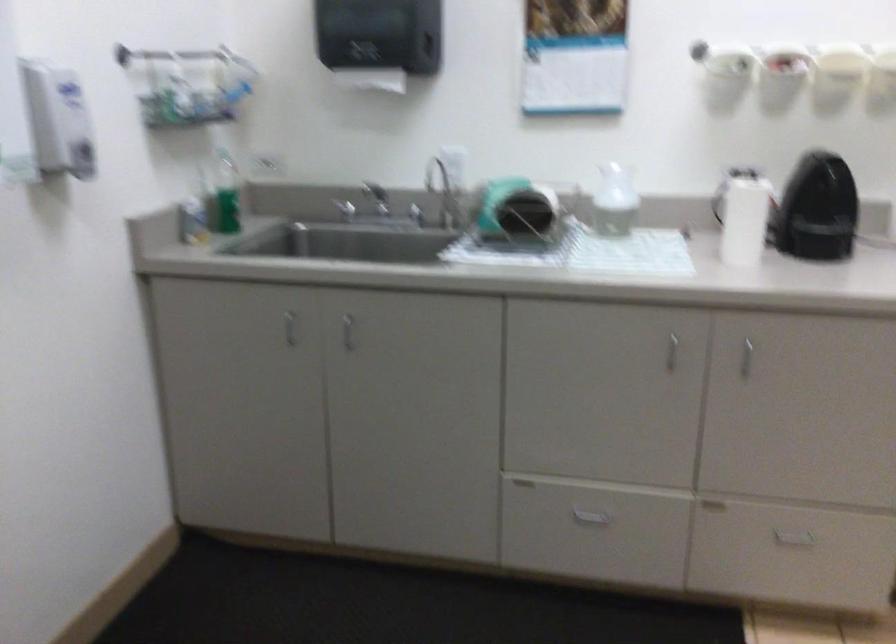
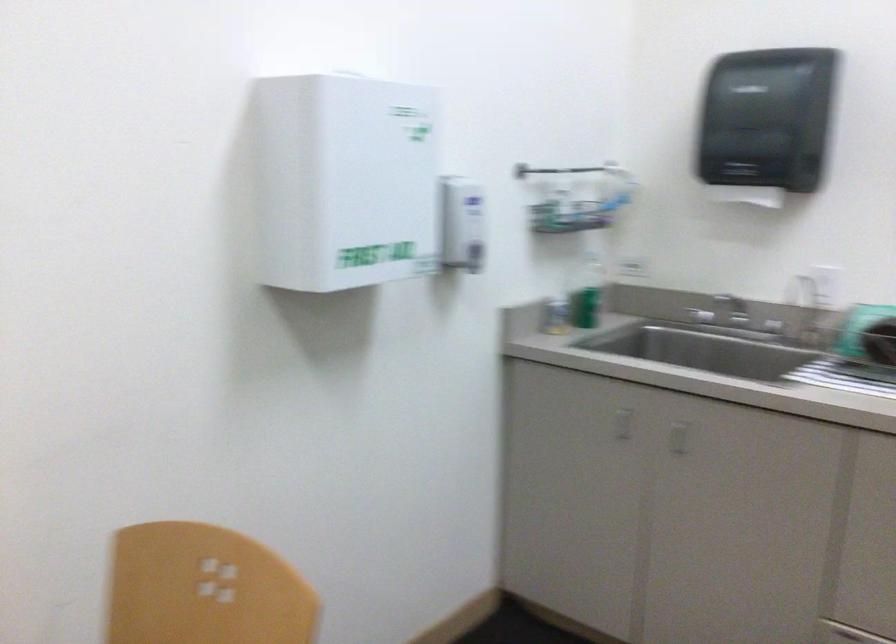
Which direction would the cameraman need to move to produce the second image?

The movement direction of the cameraman is right, backward.